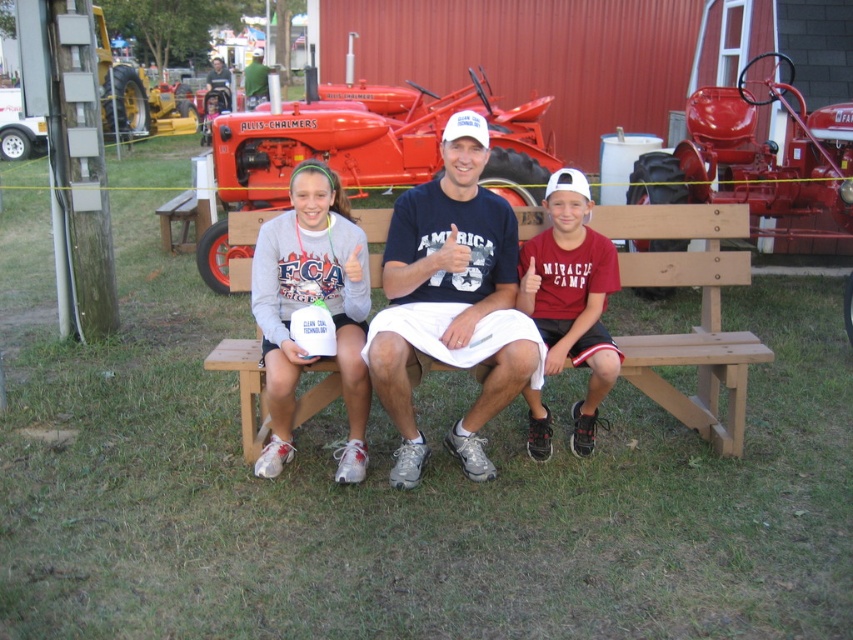
Based on the photo, based on the scene description, what is located at the coordinates point (451, 301)?

The white cotton t shirt at center is located at point (451, 301).

You are a photographer wanting to capture a photo of the wooden bench at center and the shiny red tractor at center. Which object should you focus on first if you want to include both in your frame without moving the camera?

The wooden bench at center is not as tall as the shiny red tractor at center, so you should focus on the shiny red tractor at center first to ensure it fits within the frame.